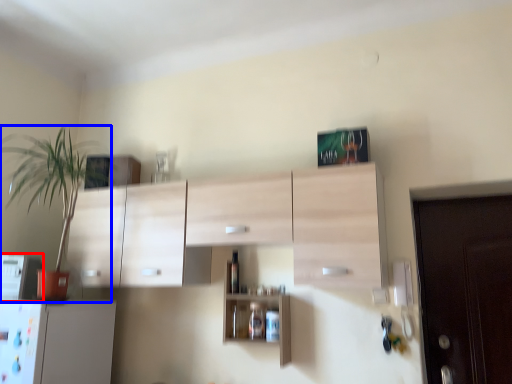
Question: Among these objects, which one is farthest to the camera, appliance (highlighted by a red box) or houseplant (highlighted by a blue box)?

Choices:
 (A) appliance
 (B) houseplant

Answer: (A)